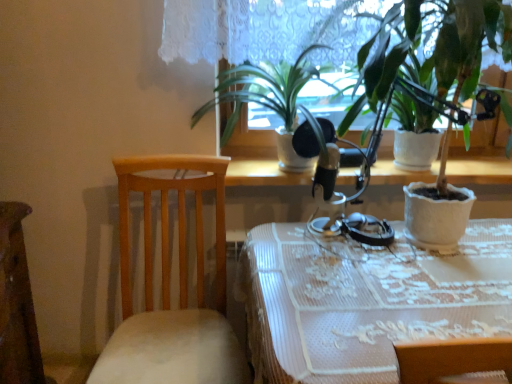
Question: Is white textured pot at right, which appears as the 1th houseplant when viewed from the right, not inside green matte plant at center, which is counted as the 2th houseplant, starting from the right?

Choices:
 (A) no
 (B) yes

Answer: (B)

Question: Can you confirm if white textured pot at right, which appears as the 1th houseplant when viewed from the right, is smaller than green matte plant at center, which is counted as the 2th houseplant, starting from the right?

Choices:
 (A) yes
 (B) no

Answer: (B)

Question: Considering the relative sizes of white textured pot at right, which appears as the 1th houseplant when viewed from the right, and green matte plant at center, acting as the first houseplant starting from the left, in the image provided, is white textured pot at right, which appears as the 1th houseplant when viewed from the right, wider than green matte plant at center, acting as the first houseplant starting from the left,?

Choices:
 (A) no
 (B) yes

Answer: (A)

Question: Is white textured pot at right, which is the 2th houseplant from left to right, positioned with its back to green matte plant at center, which is counted as the 2th houseplant, starting from the right?

Choices:
 (A) no
 (B) yes

Answer: (A)

Question: From the image's perspective, does white textured pot at right, which appears as the 1th houseplant when viewed from the right, appear lower than green matte plant at center, acting as the first houseplant starting from the left?

Choices:
 (A) yes
 (B) no

Answer: (A)

Question: In terms of height, does white textured pot at right, which appears as the 1th houseplant when viewed from the right, look taller or shorter compared to wooden chair at left?

Choices:
 (A) tall
 (B) short

Answer: (B)

Question: From the image's perspective, relative to wooden chair at left, is white textured pot at right, which is the 2th houseplant from left to right, above or below?

Choices:
 (A) below
 (B) above

Answer: (B)

Question: Is white textured pot at right, which is the 2th houseplant from left to right, situated inside wooden chair at left or outside?

Choices:
 (A) outside
 (B) inside

Answer: (A)

Question: Is point (412, 225) positioned closer to the camera than point (185, 329)?

Choices:
 (A) farther
 (B) closer

Answer: (B)

Question: Do you think green matte plant at center, which is counted as the 2th houseplant, starting from the right, is within white lace tablecloth at center, or outside of it?

Choices:
 (A) outside
 (B) inside

Answer: (A)

Question: Relative to white lace tablecloth at center, is green matte plant at center, which is counted as the 2th houseplant, starting from the right, in front or behind?

Choices:
 (A) behind
 (B) front

Answer: (A)

Question: Is point (203, 104) positioned closer to the camera than point (414, 312)?

Choices:
 (A) closer
 (B) farther

Answer: (B)

Question: Considering the positions of green matte plant at center, which is counted as the 2th houseplant, starting from the right, and white lace tablecloth at center in the image, is green matte plant at center, which is counted as the 2th houseplant, starting from the right, taller or shorter than white lace tablecloth at center?

Choices:
 (A) short
 (B) tall

Answer: (A)

Question: Choose the correct answer: Is green matte plant at center, acting as the first houseplant starting from the left, inside white textured pot at right, which appears as the 1th houseplant when viewed from the right, or outside it?

Choices:
 (A) inside
 (B) outside

Answer: (B)

Question: In terms of size, does green matte plant at center, which is counted as the 2th houseplant, starting from the right, appear bigger or smaller than white textured pot at right, which is the 2th houseplant from left to right?

Choices:
 (A) small
 (B) big

Answer: (A)